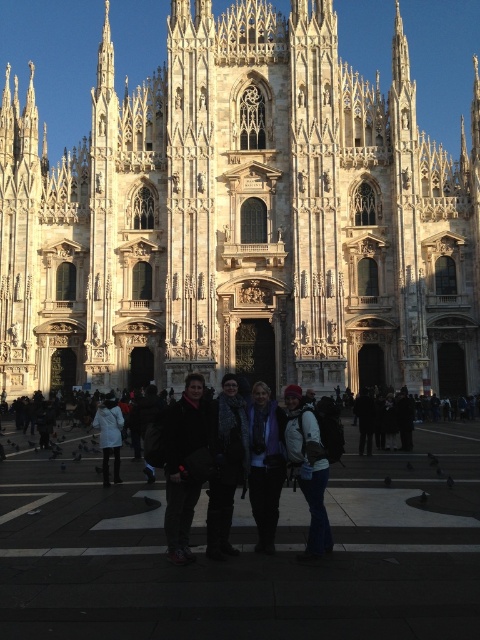
Which of these two, white stone church at center or denim jacket at center, stands shorter?

With less height is denim jacket at center.

Who is positioned more to the left, white stone church at center or denim jacket at center?

From the viewer's perspective, white stone church at center appears more on the left side.

Describe the element at coordinates (240, 220) in the screenshot. I see `white stone church at center` at that location.

You are a GUI agent. You are given a task and a screenshot of the screen. Output one action in this format:
    pyautogui.click(x=<x>, y=<y>)
    Task: Click on the white stone church at center
    
    Given the screenshot: What is the action you would take?
    pyautogui.click(x=240, y=220)

From the picture: Does dark gray sweater at center appear on the left side of white matte jacket at center?

In fact, dark gray sweater at center is to the right of white matte jacket at center.

This screenshot has width=480, height=640. What do you see at coordinates (227, 467) in the screenshot?
I see `dark gray sweater at center` at bounding box center [227, 467].

Image resolution: width=480 pixels, height=640 pixels. I want to click on dark gray sweater at center, so click(227, 467).

Can you confirm if denim jacket at center is bigger than white matte jacket at center?

Incorrect, denim jacket at center is not larger than white matte jacket at center.

Is point (300, 458) farther from viewer compared to point (103, 426)?

No, (300, 458) is closer to viewer.

At what (x,y) coordinates should I click in order to perform the action: click on denim jacket at center. Please return your answer as a coordinate pair (x, y). Looking at the image, I should click on (308, 468).

The height and width of the screenshot is (640, 480). I want to click on denim jacket at center, so [x=308, y=468].